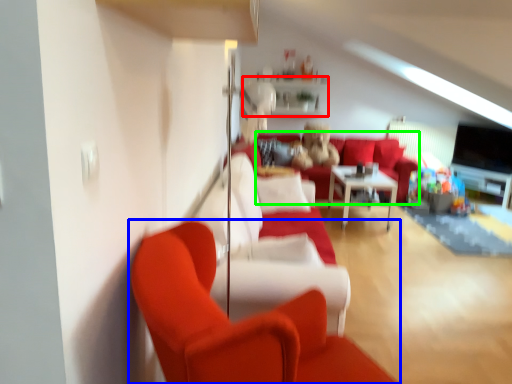
Question: Which is nearer to the shelf (highlighted by a red box)? studio couch (highlighted by a blue box) or couch (highlighted by a green box).

Choices:
 (A) studio couch
 (B) couch

Answer: (B)